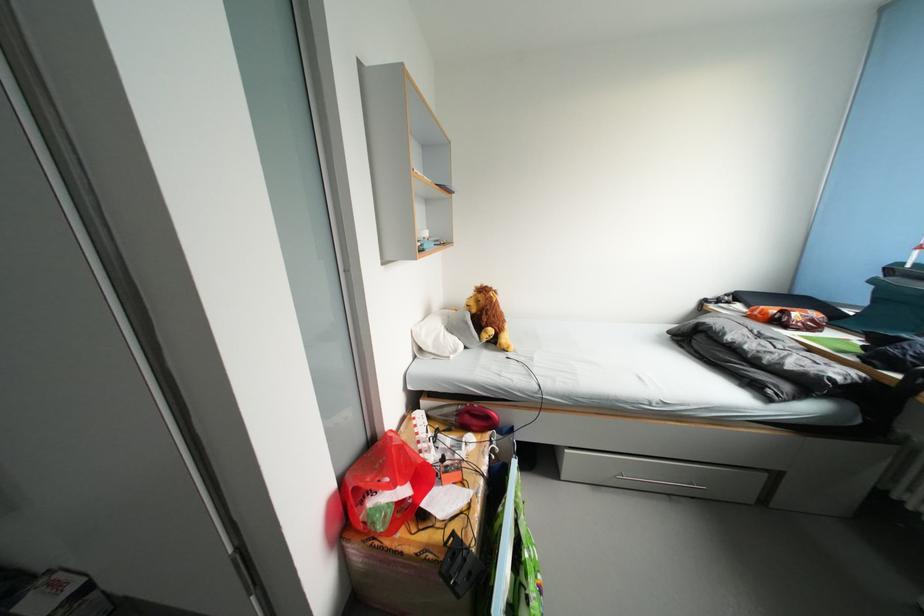
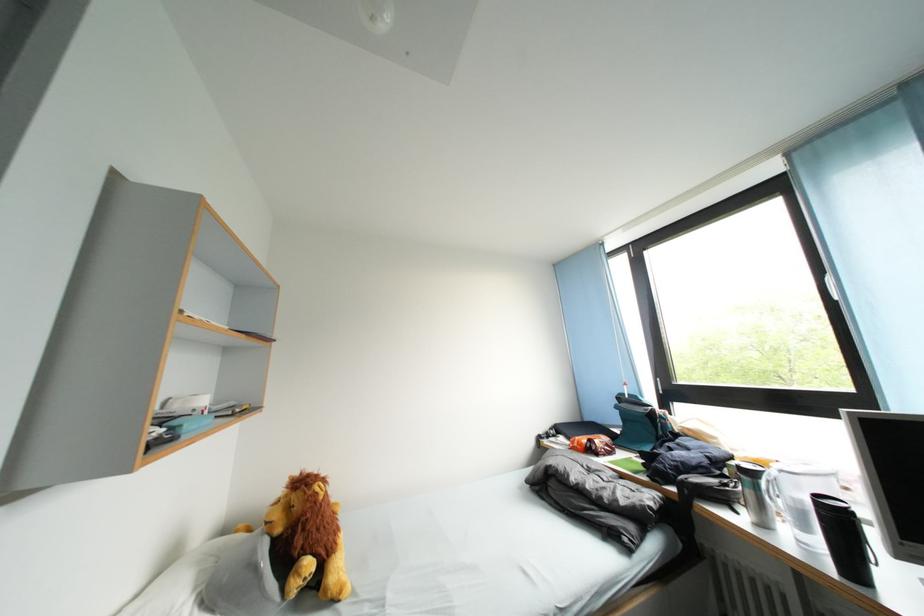
In the second image, find the point that corresponds to point (776, 363) in the first image.

(614, 501)